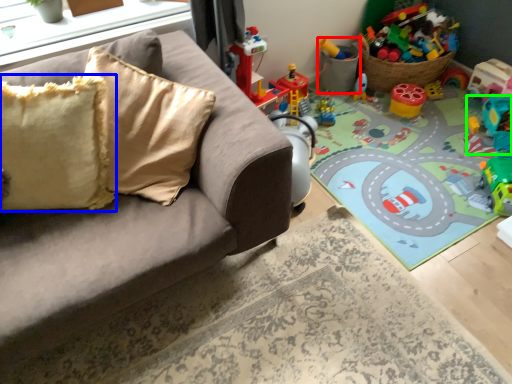
Question: Considering the real-world distances, which object is closest to toy (highlighted by a red box)? pillow (highlighted by a blue box) or toy (highlighted by a green box).

Choices:
 (A) pillow
 (B) toy

Answer: (B)